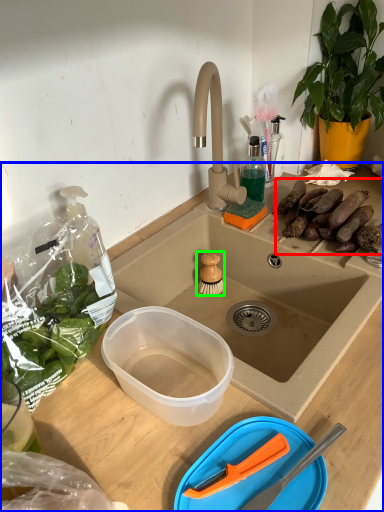
Question: Estimate the real-world distances between objects in this image. Which object is farther from food (highlighted by a red box), desk (highlighted by a blue box) or brush (highlighted by a green box)?

Choices:
 (A) desk
 (B) brush

Answer: (B)